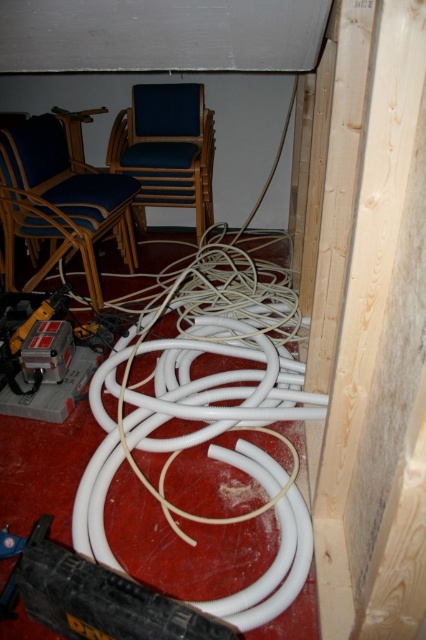
Based on the photo, you are an interior designer inspecting the construction site. You see the matte blue wood chair at upper left and the blue fabric chair at center. Which chair is located to the left of the other?

The matte blue wood chair at upper left is positioned on the left side of blue fabric chair at center, so it is located to the left of the blue fabric chair at center.

You are holding a camera and want to take a photo of the blue fabric chair at center. If you are standing 2 meters away from the chair, can you move closer to get a better shot without exceeding the recommended distance of 2.5 meters?

The blue fabric chair at center and camera are 2.69 meters apart from each other. Since you are currently 2 meters away, you can move closer up to 0.69 meters to stay within the 2.5 meter limit.